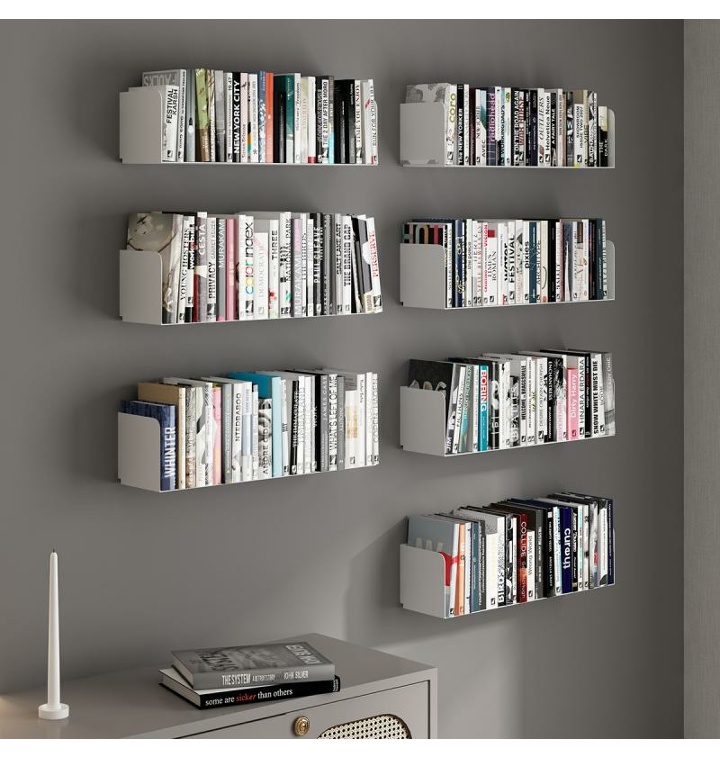
Identify the location of shelves attached to the wall. (507, 568), (284, 421), (515, 409), (314, 257), (521, 264), (281, 142), (446, 141).